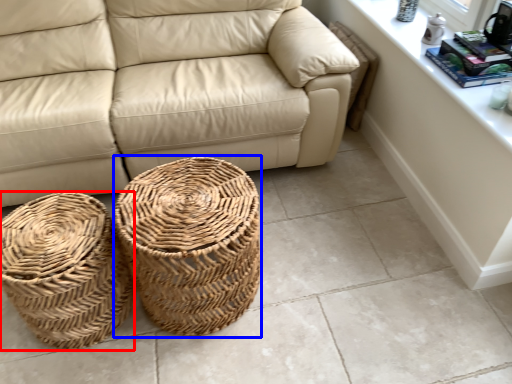
Question: Which of the following is the closest to the observer, basket (highlighted by a red box) or basket (highlighted by a blue box)?

Choices:
 (A) basket
 (B) basket

Answer: (B)